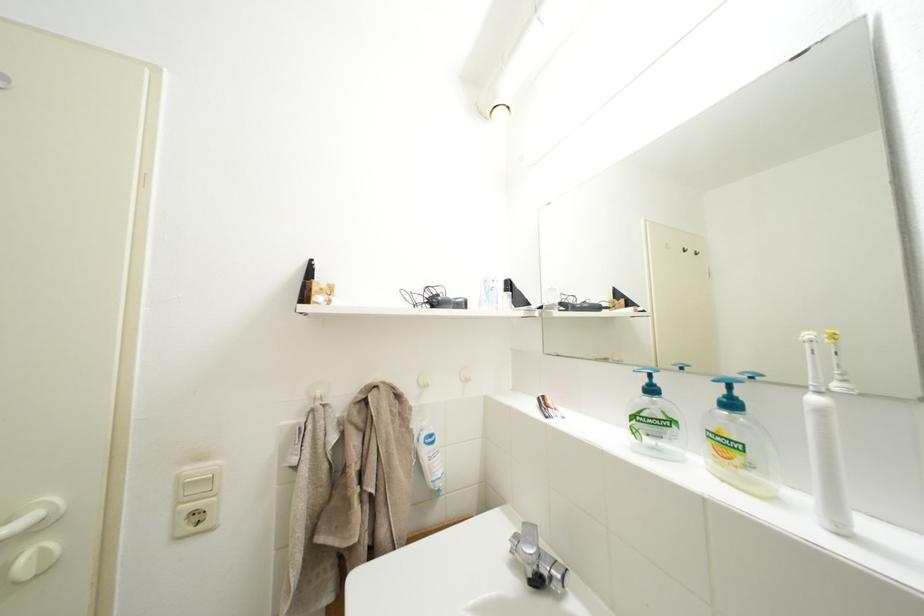
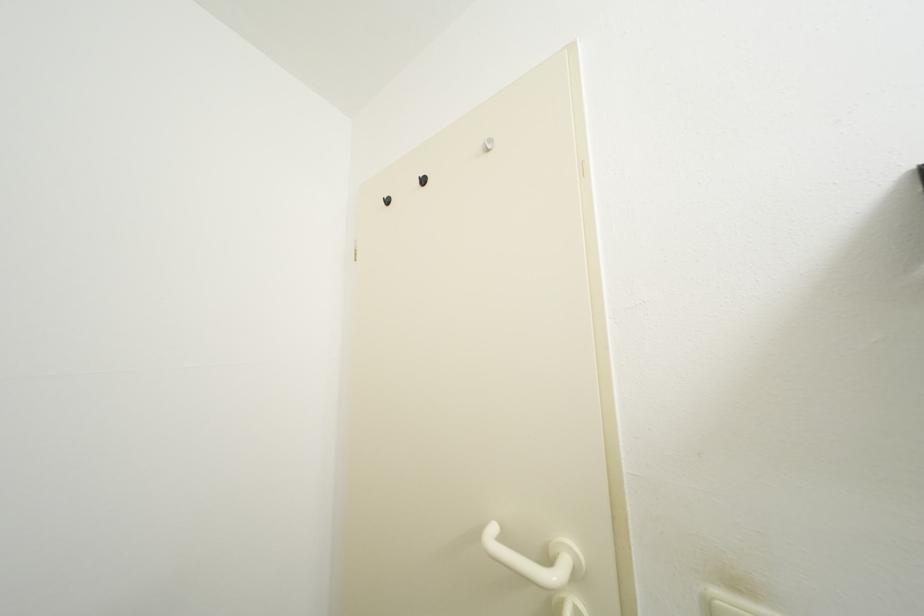
Question: The first image is from the beginning of the video and the second image is from the end. How did the camera likely rotate when shooting the video?

Choices:
 (A) Left
 (B) Right
 (C) Up
 (D) Down

Answer: (A)